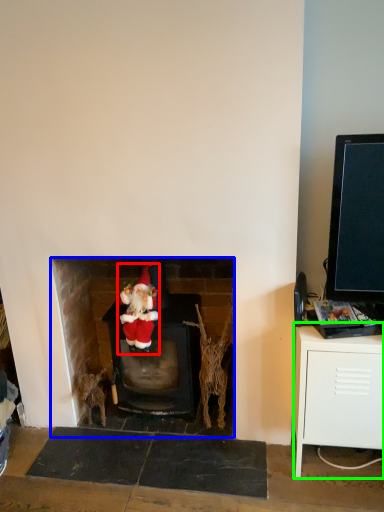
Question: Which object is positioned farthest from person (highlighted by a red box)? Select from fireplace (highlighted by a blue box) and table (highlighted by a green box).

Choices:
 (A) fireplace
 (B) table

Answer: (B)